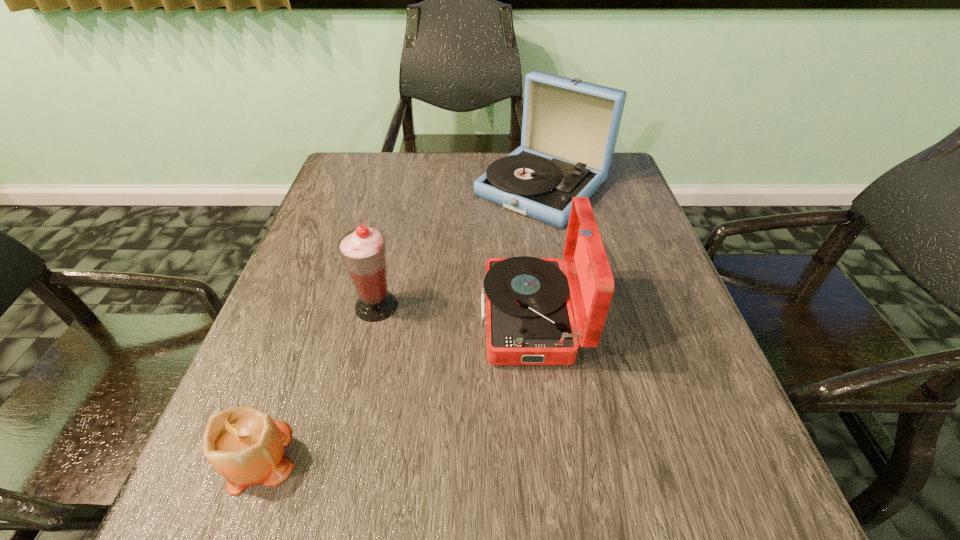
I want to click on free spot at the left edge of the desktop, so click(317, 217).

At what (x,y) coordinates should I click in order to perform the action: click on blank space at the right edge of the desktop. Please return your answer as a coordinate pair (x, y). The image size is (960, 540). Looking at the image, I should click on (685, 449).

The height and width of the screenshot is (540, 960). In order to click on free location at the far left corner in this screenshot , I will do `click(362, 167)`.

In the image, there is a desktop. What are the coordinates of `free space at the far right corner` in the screenshot? It's located at (612, 180).

Image resolution: width=960 pixels, height=540 pixels. I want to click on vacant space at the near right corner of the desktop, so click(x=708, y=488).

You are a GUI agent. You are given a task and a screenshot of the screen. Output one action in this format:
    pyautogui.click(x=<x>, y=<y>)
    Task: Click on the vacant space that's between the leftmost object and the farther phonograph_record
    
    Given the screenshot: What is the action you would take?
    pyautogui.click(x=399, y=322)

At what (x,y) coordinates should I click in order to perform the action: click on empty space between the shorter phonograph_record and the farther phonograph_record. Please return your answer as a coordinate pair (x, y). The width and height of the screenshot is (960, 540). Looking at the image, I should click on (537, 252).

Locate an element on the screen. The image size is (960, 540). free space between the candle and the farthest object is located at coordinates (399, 322).

Locate an element on the screen. free space between the nearest object and the farther phonograph_record is located at coordinates (399, 322).

You are a GUI agent. You are given a task and a screenshot of the screen. Output one action in this format:
    pyautogui.click(x=<x>, y=<y>)
    Task: Click on the free space between the shorter phonograph_record and the farther phonograph_record
    
    Given the screenshot: What is the action you would take?
    pyautogui.click(x=537, y=252)